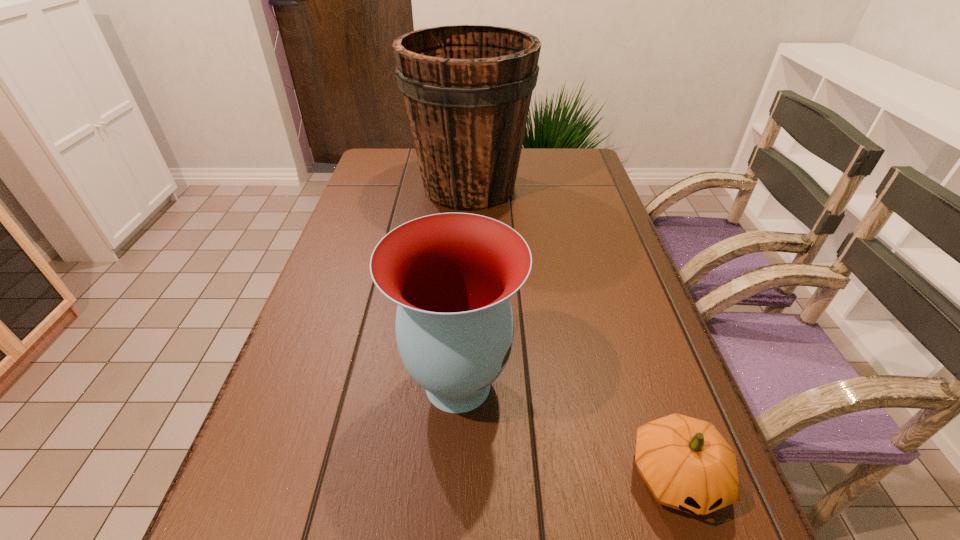
You are a GUI agent. You are given a task and a screenshot of the screen. Output one action in this format:
    pyautogui.click(x=<x>, y=<y>)
    Task: Click on the bucket
    
    Given the screenshot: What is the action you would take?
    pyautogui.click(x=467, y=89)

Where is `the farthest object`? The width and height of the screenshot is (960, 540). the farthest object is located at coordinates (467, 89).

The image size is (960, 540). What are the coordinates of `the second tallest object` in the screenshot? It's located at (452, 274).

Where is `the shortest object`? the shortest object is located at coordinates (687, 465).

Where is `gourd`? The width and height of the screenshot is (960, 540). gourd is located at coordinates (687, 465).

Locate an element on the screen. blank space located 0.100m on the front of the bucket is located at coordinates (468, 242).

This screenshot has height=540, width=960. What are the coordinates of `free spot located 0.080m on the right of the second tallest object` in the screenshot? It's located at (564, 384).

Locate an element on the screen. This screenshot has width=960, height=540. object present at the far edge is located at coordinates (467, 89).

You are a GUI agent. You are given a task and a screenshot of the screen. Output one action in this format:
    pyautogui.click(x=<x>, y=<y>)
    Task: Click on the object at the left edge
    The height and width of the screenshot is (540, 960).
    Given the screenshot: What is the action you would take?
    pyautogui.click(x=467, y=89)

Where is `object located in the right edge section of the desktop`? Image resolution: width=960 pixels, height=540 pixels. object located in the right edge section of the desktop is located at coordinates (687, 465).